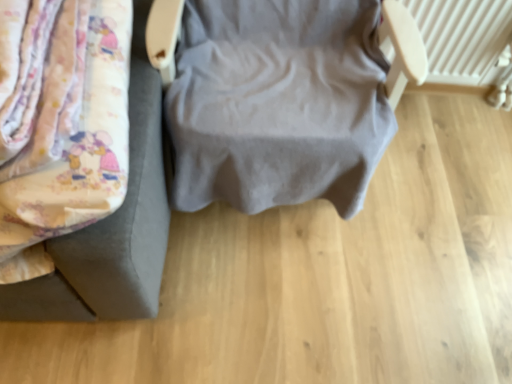
Question: Are fluffy fabric bed at left, which is the first furniture in left-to-right order, and gray fabric chair at center, which is counted as the second furniture, starting from the left, making contact?

Choices:
 (A) yes
 (B) no

Answer: (B)

Question: Can you confirm if fluffy fabric bed at left, which is the first furniture in left-to-right order, is bigger than gray fabric chair at center, which is counted as the second furniture, starting from the left?

Choices:
 (A) no
 (B) yes

Answer: (A)

Question: Is gray fabric chair at center, which is counted as the second furniture, starting from the left, a part of fluffy fabric bed at left, which is the first furniture in left-to-right order?

Choices:
 (A) no
 (B) yes

Answer: (A)

Question: Can you confirm if fluffy fabric bed at left, acting as the 2th furniture starting from the right, is smaller than gray fabric chair at center, which is counted as the second furniture, starting from the left?

Choices:
 (A) yes
 (B) no

Answer: (A)

Question: Could you tell me if fluffy fabric bed at left, acting as the 2th furniture starting from the right, is facing gray fabric chair at center, which is counted as the second furniture, starting from the left?

Choices:
 (A) yes
 (B) no

Answer: (B)

Question: Looking at their shapes, would you say gray fabric chair at center, which is the 1th furniture in right-to-left order, is wider or thinner than white textured radiator at upper right?

Choices:
 (A) thin
 (B) wide

Answer: (B)

Question: From the image's perspective, is gray fabric chair at center, which is the 1th furniture in right-to-left order, located above or below white textured radiator at upper right?

Choices:
 (A) below
 (B) above

Answer: (A)

Question: In the image, is gray fabric chair at center, which is counted as the second furniture, starting from the left, positioned in front of or behind white textured radiator at upper right?

Choices:
 (A) front
 (B) behind

Answer: (A)

Question: Considering the positions of gray fabric chair at center, which is the 1th furniture in right-to-left order, and white textured radiator at upper right in the image, is gray fabric chair at center, which is the 1th furniture in right-to-left order, bigger or smaller than white textured radiator at upper right?

Choices:
 (A) big
 (B) small

Answer: (A)

Question: Considering the positions of point pyautogui.click(x=508, y=33) and point pyautogui.click(x=155, y=137), is point pyautogui.click(x=508, y=33) closer or farther from the camera than point pyautogui.click(x=155, y=137)?

Choices:
 (A) closer
 (B) farther

Answer: (B)

Question: In terms of size, does white textured radiator at upper right appear bigger or smaller than fluffy fabric bed at left, acting as the 2th furniture starting from the right?

Choices:
 (A) big
 (B) small

Answer: (B)

Question: In terms of width, does white textured radiator at upper right look wider or thinner when compared to fluffy fabric bed at left, which is the first furniture in left-to-right order?

Choices:
 (A) wide
 (B) thin

Answer: (B)

Question: From a real-world perspective, relative to fluffy fabric bed at left, which is the first furniture in left-to-right order, is white textured radiator at upper right vertically above or below?

Choices:
 (A) above
 (B) below

Answer: (B)

Question: Is point (157, 89) positioned closer to the camera than point (205, 18)?

Choices:
 (A) farther
 (B) closer

Answer: (B)

Question: Is fluffy fabric bed at left, acting as the 2th furniture starting from the right, to the left or to the right of gray fabric chair at center, which is counted as the second furniture, starting from the left, in the image?

Choices:
 (A) right
 (B) left

Answer: (B)